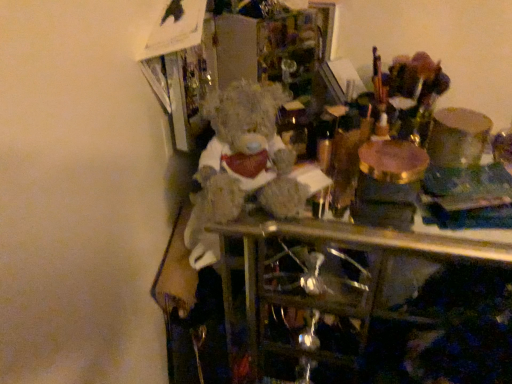
Question: From a real-world perspective, relative to translucent glass wine bottle at center, is fuzzy fabric teddy bear at center vertically above or below?

Choices:
 (A) above
 (B) below

Answer: (A)

Question: Looking at their shapes, would you say fuzzy fabric teddy bear at center is wider or thinner than translucent glass wine bottle at center?

Choices:
 (A) thin
 (B) wide

Answer: (B)

Question: In terms of size, does fuzzy fabric teddy bear at center appear bigger or smaller than translucent glass wine bottle at center?

Choices:
 (A) big
 (B) small

Answer: (A)

Question: Does point click(x=294, y=129) appear closer or farther from the camera than point click(x=267, y=178)?

Choices:
 (A) closer
 (B) farther

Answer: (B)

Question: From their relative heights in the image, would you say translucent glass wine bottle at center is taller or shorter than fuzzy fabric teddy bear at center?

Choices:
 (A) short
 (B) tall

Answer: (A)

Question: Based on their positions, is translucent glass wine bottle at center located to the left or right of fuzzy fabric teddy bear at center?

Choices:
 (A) left
 (B) right

Answer: (B)

Question: From a real-world perspective, is translucent glass wine bottle at center physically located above or below fuzzy fabric teddy bear at center?

Choices:
 (A) below
 (B) above

Answer: (A)